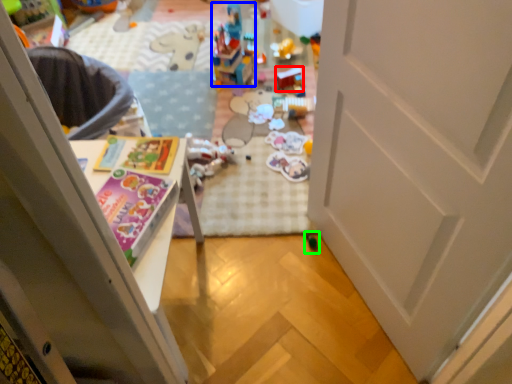
Question: Which object is positioned farthest from toy (highlighted by a red box)? Select from toy (highlighted by a blue box) and toy (highlighted by a green box).

Choices:
 (A) toy
 (B) toy

Answer: (B)